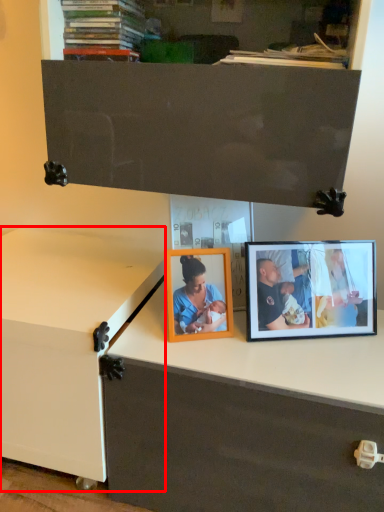
Question: From the image's perspective, where is changing table (annotated by the red box) located in relation to picture frame in the image?

Choices:
 (A) above
 (B) below

Answer: (B)